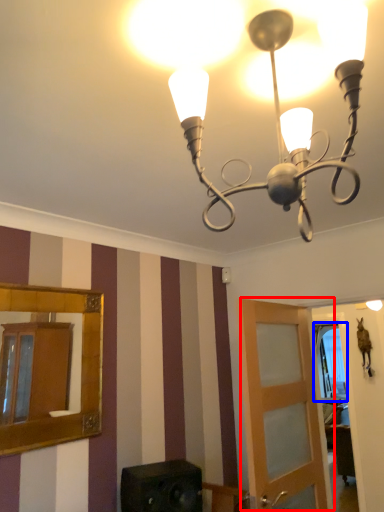
Question: Among these objects, which one is farthest to the camera, door (highlighted by a red box) or window (highlighted by a blue box)?

Choices:
 (A) door
 (B) window

Answer: (B)